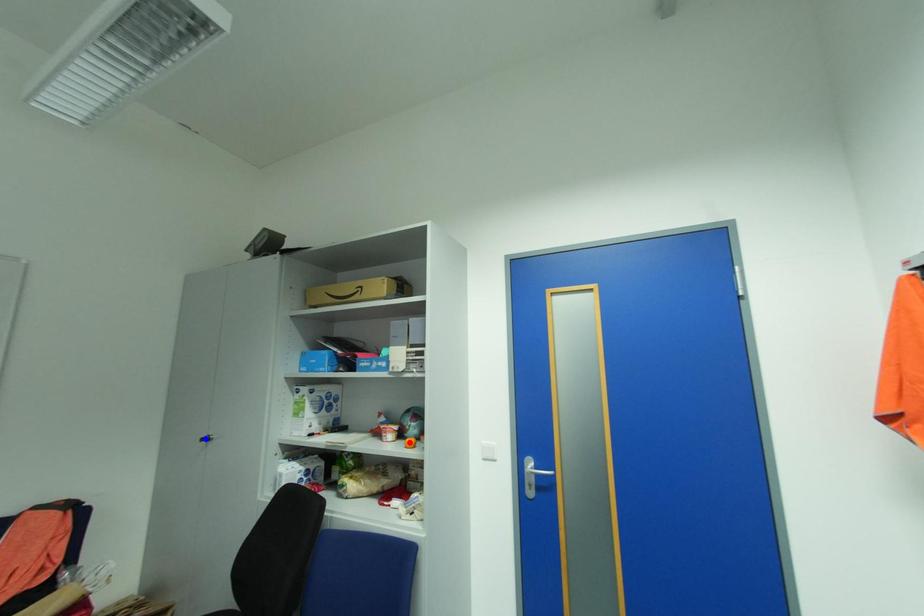
Question: Two points are marked on the image. Which point is closer to the camera?

Choices:
 (A) Blue point is closer.
 (B) Red point is closer.

Answer: (B)